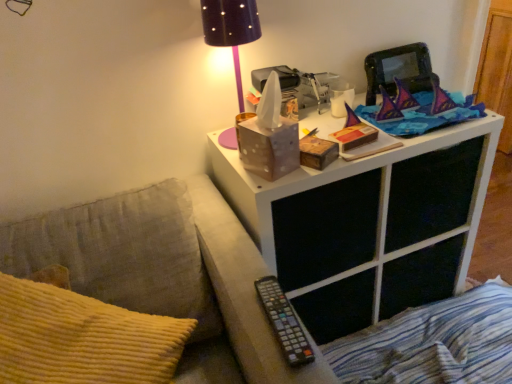
Question: Is black plastic remote at lower center at the left side of white matte side table at upper right?

Choices:
 (A) yes
 (B) no

Answer: (B)

Question: From the image's perspective, is black plastic remote at lower center on white matte side table at upper right?

Choices:
 (A) yes
 (B) no

Answer: (A)

Question: From the image's perspective, would you say black plastic remote at lower center is shown under white matte side table at upper right?

Choices:
 (A) no
 (B) yes

Answer: (A)

Question: From a real-world perspective, is black plastic remote at lower center physically above white matte side table at upper right?

Choices:
 (A) no
 (B) yes

Answer: (B)

Question: Is black plastic remote at lower center outside of white matte side table at upper right?

Choices:
 (A) no
 (B) yes

Answer: (A)

Question: Would you say blue striped fabric at lower right is to the left or to the right of white matte side table at upper right in the picture?

Choices:
 (A) left
 (B) right

Answer: (B)

Question: Relative to white matte side table at upper right, is blue striped fabric at lower right in front or behind?

Choices:
 (A) behind
 (B) front

Answer: (A)

Question: In terms of height, does blue striped fabric at lower right look taller or shorter compared to white matte side table at upper right?

Choices:
 (A) short
 (B) tall

Answer: (A)

Question: Would you say blue striped fabric at lower right is inside or outside white matte side table at upper right?

Choices:
 (A) inside
 (B) outside

Answer: (B)

Question: Is white matte side table at upper right bigger or smaller than blue striped fabric at lower right?

Choices:
 (A) small
 (B) big

Answer: (B)

Question: Do you think white matte side table at upper right is within blue striped fabric at lower right, or outside of it?

Choices:
 (A) inside
 (B) outside

Answer: (B)

Question: Considering the positions of white matte side table at upper right and blue striped fabric at lower right in the image, is white matte side table at upper right taller or shorter than blue striped fabric at lower right?

Choices:
 (A) tall
 (B) short

Answer: (A)

Question: Relative to blue striped fabric at lower right, is white matte side table at upper right in front or behind?

Choices:
 (A) front
 (B) behind

Answer: (A)

Question: Considering their positions, is white matte nightstand at upper right located in front of or behind blue striped fabric at lower right?

Choices:
 (A) front
 (B) behind

Answer: (A)

Question: Considering the positions of white matte nightstand at upper right and blue striped fabric at lower right in the image, is white matte nightstand at upper right wider or thinner than blue striped fabric at lower right?

Choices:
 (A) wide
 (B) thin

Answer: (A)